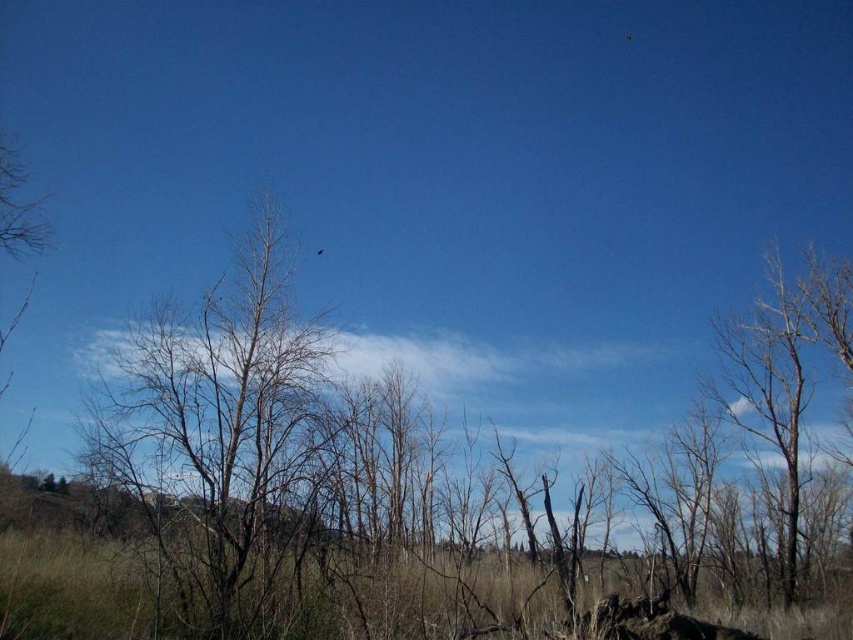
Question: Does brown bare tree at center have a larger size compared to bare wood tree at right?

Choices:
 (A) yes
 (B) no

Answer: (A)

Question: Which object is the farthest from the bare wood tree at right?

Choices:
 (A) black glossy bird at upper center
 (B) brown bare tree at center

Answer: (B)

Question: Can you confirm if brown bare tree at center is smaller than black glossy bird at upper center?

Choices:
 (A) yes
 (B) no

Answer: (B)

Question: Can you confirm if bare wood tree at right is thinner than black glossy bird at upper center?

Choices:
 (A) yes
 (B) no

Answer: (B)

Question: Which object is farther from the camera taking this photo?

Choices:
 (A) brown bare tree at center
 (B) bare wood tree at right

Answer: (B)

Question: Which object appears closest to the camera in this image?

Choices:
 (A) bare wood tree at right
 (B) brown bare tree at center
 (C) black glossy bird at upper center

Answer: (B)